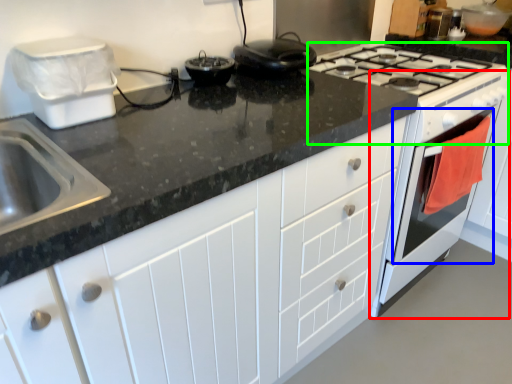
Question: Which object is the closest to the oven (highlighted by a red box)? Choose among these: oven (highlighted by a blue box) or gas stove (highlighted by a green box).

Choices:
 (A) oven
 (B) gas stove

Answer: (A)